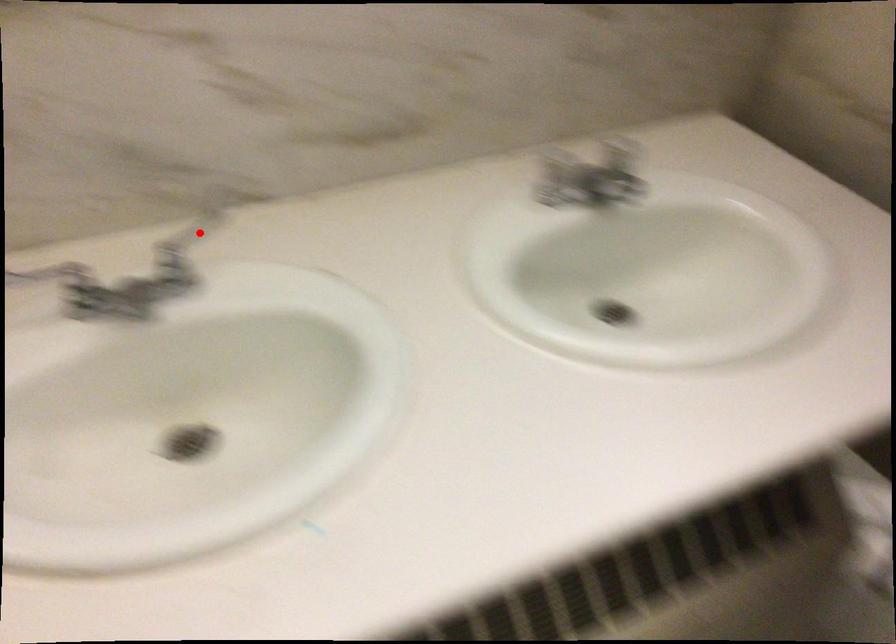
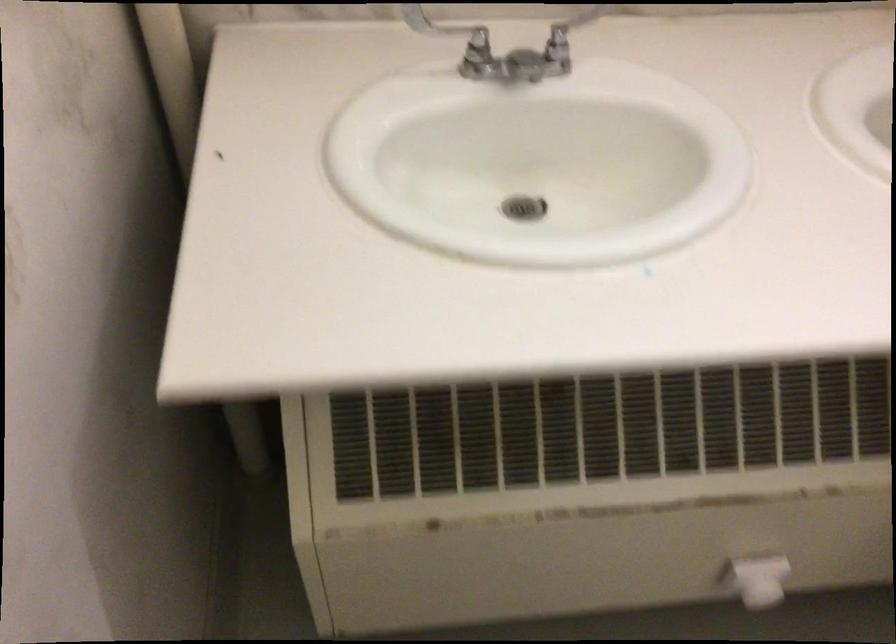
Question: I am providing you with two images of the same scene from different viewpoints. Given a red point in image1, look at the same physical point in image2. Is it:

Choices:
 (A) Closer to the viewpoint
 (B) Farther from the viewpoint

Answer: (B)